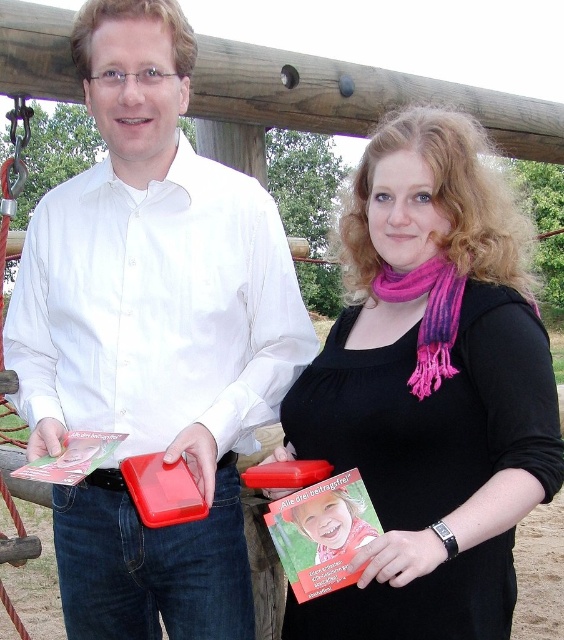
Which is more to the right, matte plastic book at center or matte black book at center?

Positioned to the right is matte black book at center.

From the picture: Who is more distant from viewer, (175, 636) or (372, 628)?

The point (175, 636) is more distant.

The height and width of the screenshot is (640, 564). In order to click on matte plastic book at center in this screenshot , I will do `click(152, 337)`.